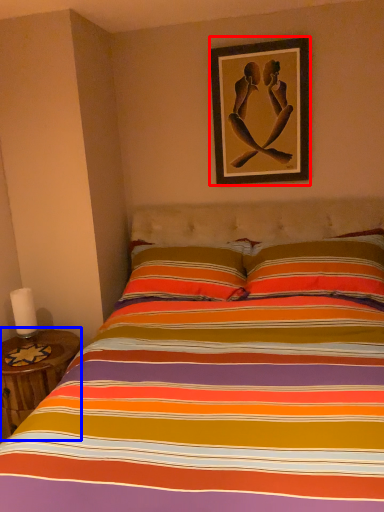
Question: Which object is further to the camera taking this photo, picture frame (highlighted by a red box) or table (highlighted by a blue box)?

Choices:
 (A) picture frame
 (B) table

Answer: (A)